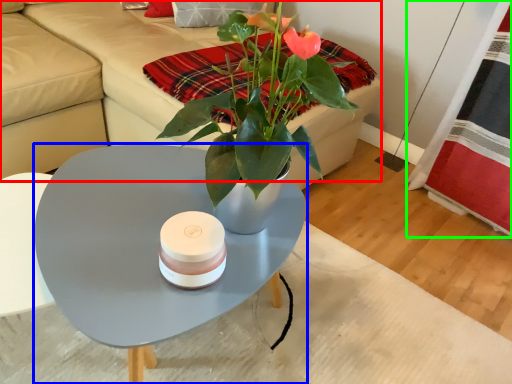
Question: Which object is the closest to the couch (highlighted by a red box)? Choose among these: coffee table (highlighted by a blue box) or plaid (highlighted by a green box).

Choices:
 (A) coffee table
 (B) plaid

Answer: (A)